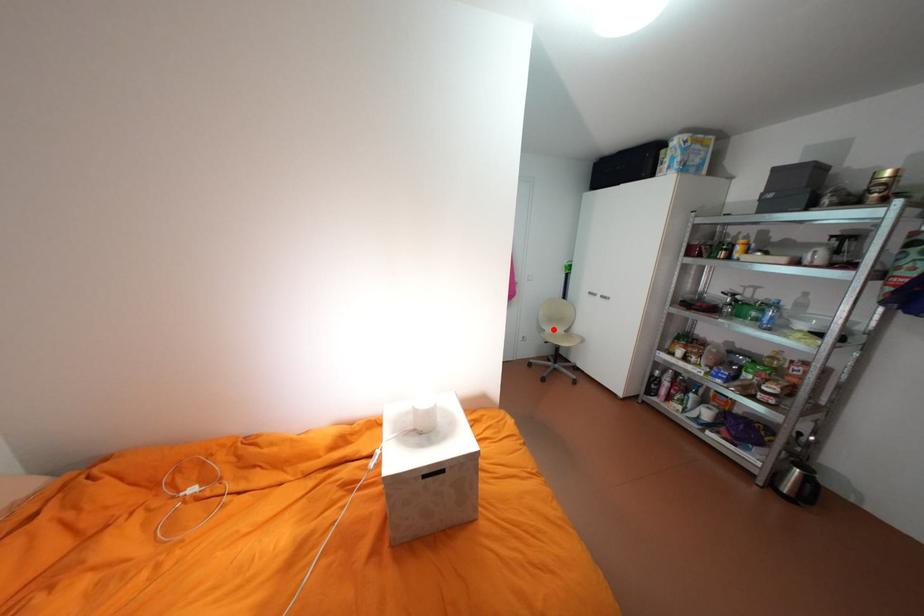
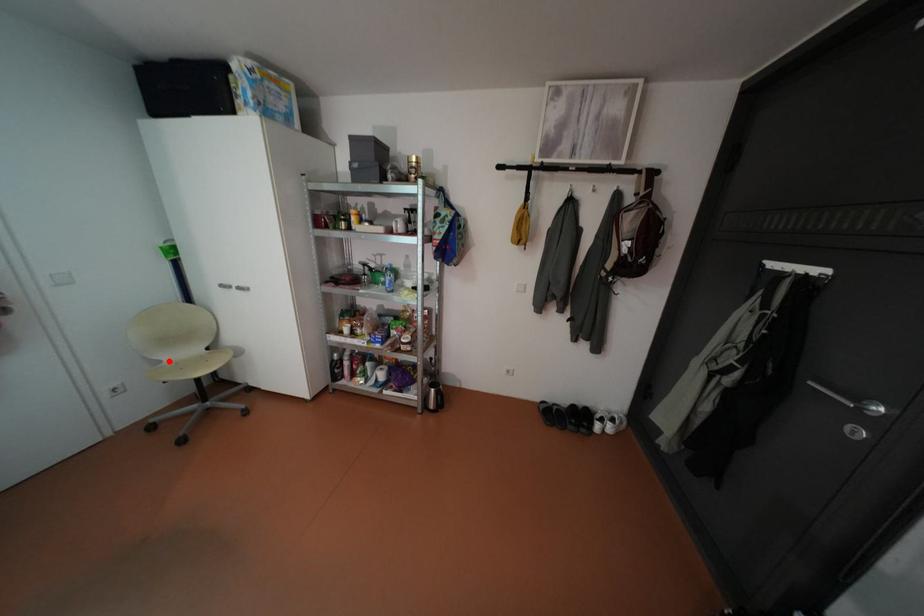
I am providing you with two images of the same scene from different viewpoints. A red point is marked on the first image and another point is marked on the second image. Do the highlighted points in image1 and image2 indicate the same real-world spot?

Yes